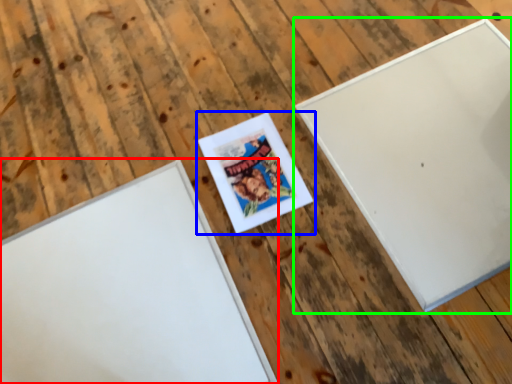
Question: Based on their relative distances, which object is nearer to picture frame (highlighted by a red box)? Choose from picture frame (highlighted by a blue box) and picture frame (highlighted by a green box).

Choices:
 (A) picture frame
 (B) picture frame

Answer: (A)